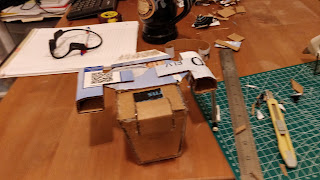
Identify the location of file folder. This screenshot has height=180, width=320. (35, 17).